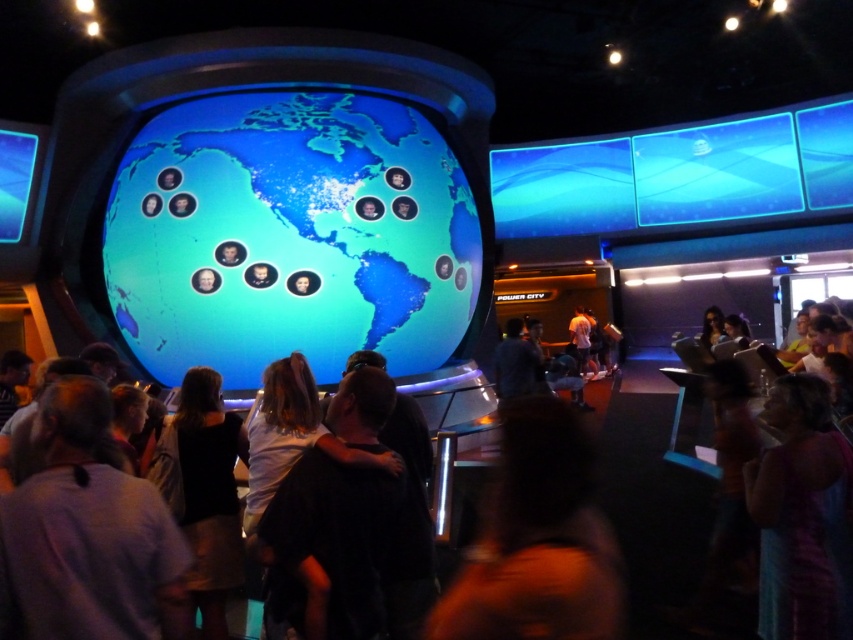
You are standing in the museum and want to take a photo of the blue glossy globe at center without anyone in the background. The dark clothing crowd at center is 28.71 feet away from the globe. Is the distance sufficient to avoid the crowd appearing in your photo?

The blue glossy globe at center is 28.71 feet away from the dark clothing crowd at center. This distance is likely sufficient to avoid the crowd appearing in the background of your photo, as they are relatively far from the globe.

You are a visitor at the museum and want to take a photo of the blue glossy globe at center without anyone blocking the view. Can you position yourself in a way that the dark clothing crowd at center won

The blue glossy globe at center is above the dark clothing crowd at center, so positioning yourself at a lower angle or moving to a spot where the crowd is not directly in front of the globe should allow you to capture the globe without obstruction.